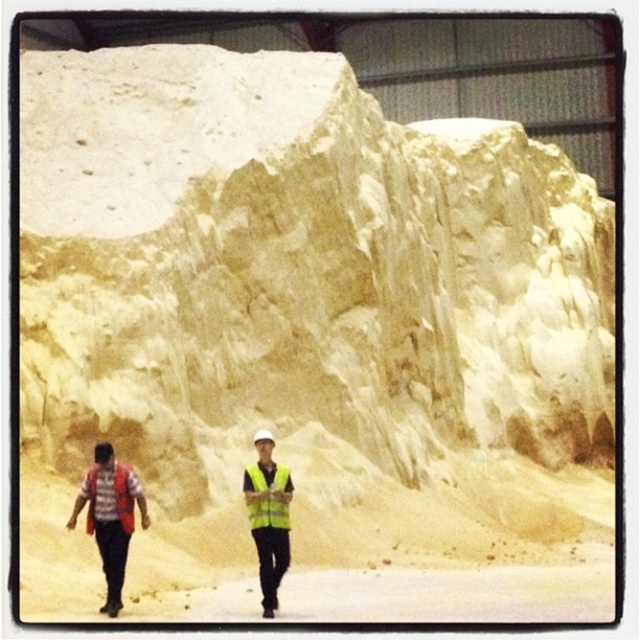
You are a construction worker planning to place a 2 meter tall safety barrier between the yellowish sandstone cliff at upper center and the yellow reflective safety vest at center. Considering their heights, is this feasible?

The yellowish sandstone cliff at upper center is much taller than the yellow reflective safety vest at center, so placing a 2 meter tall safety barrier between them is feasible as the cliff is higher than the barrier height.

You are a hiker standing at the base of the yellowish sandstone cliff at upper center. You want to reach the top of the cliff. The cliff is 48.96 meters away from you. Do you think you can climb it?

The yellowish sandstone cliff at upper center is 48.96 meters away from the viewer. However, the distance between you and the cliff does not indicate its height. Climbing feasibility depends on the cliff height, not the horizontal distance. Without information about the cliff height, it is impossible to determine if you can climb it.